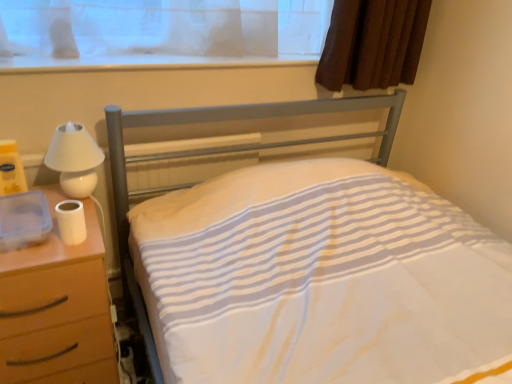
Question: Is white glossy lamp at left at the back of white matte toilet paper at left?

Choices:
 (A) yes
 (B) no

Answer: (A)

Question: Can you confirm if white matte toilet paper at left is thinner than white glossy lamp at left?

Choices:
 (A) yes
 (B) no

Answer: (A)

Question: Can you confirm if white matte toilet paper at left is taller than white glossy lamp at left?

Choices:
 (A) no
 (B) yes

Answer: (A)

Question: From a real-world perspective, is white matte toilet paper at left physically below white glossy lamp at left?

Choices:
 (A) yes
 (B) no

Answer: (A)

Question: From a real-world perspective, does white matte toilet paper at left stand above white glossy lamp at left?

Choices:
 (A) no
 (B) yes

Answer: (A)

Question: Can you confirm if white matte toilet paper at left is wider than white glossy lamp at left?

Choices:
 (A) no
 (B) yes

Answer: (A)

Question: Is white striped fabric at center outside white matte nightstand at left?

Choices:
 (A) no
 (B) yes

Answer: (B)

Question: Does white striped fabric at center have a greater height compared to white matte nightstand at left?

Choices:
 (A) yes
 (B) no

Answer: (A)

Question: Does white striped fabric at center have a greater width compared to white matte nightstand at left?

Choices:
 (A) yes
 (B) no

Answer: (A)

Question: Is white striped fabric at center next to white matte nightstand at left and touching it?

Choices:
 (A) yes
 (B) no

Answer: (B)

Question: Can white matte nightstand at left be found inside white striped fabric at center?

Choices:
 (A) yes
 (B) no

Answer: (B)

Question: Is white striped fabric at center in front of white matte nightstand at left?

Choices:
 (A) yes
 (B) no

Answer: (A)

Question: From the image's perspective, is white plastic window sill at upper center on top of white matte toilet paper at left?

Choices:
 (A) no
 (B) yes

Answer: (B)